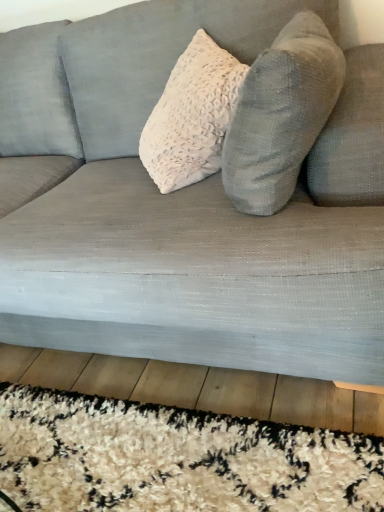
Where is `free spot above white shaggy rug at lower center (from a real-world perspective)`? The height and width of the screenshot is (512, 384). free spot above white shaggy rug at lower center (from a real-world perspective) is located at coordinates (134, 451).